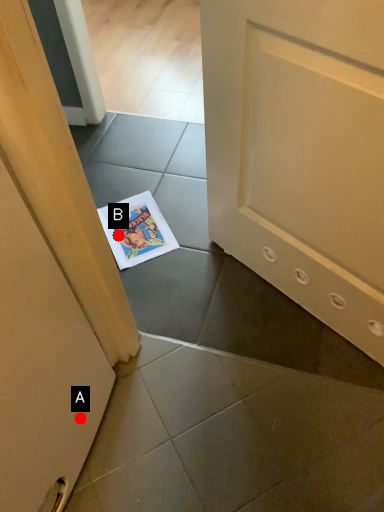
Question: Two points are circled on the image, labeled by A and B beside each circle. Which point is closer to the camera?

Choices:
 (A) A is closer
 (B) B is closer

Answer: (A)